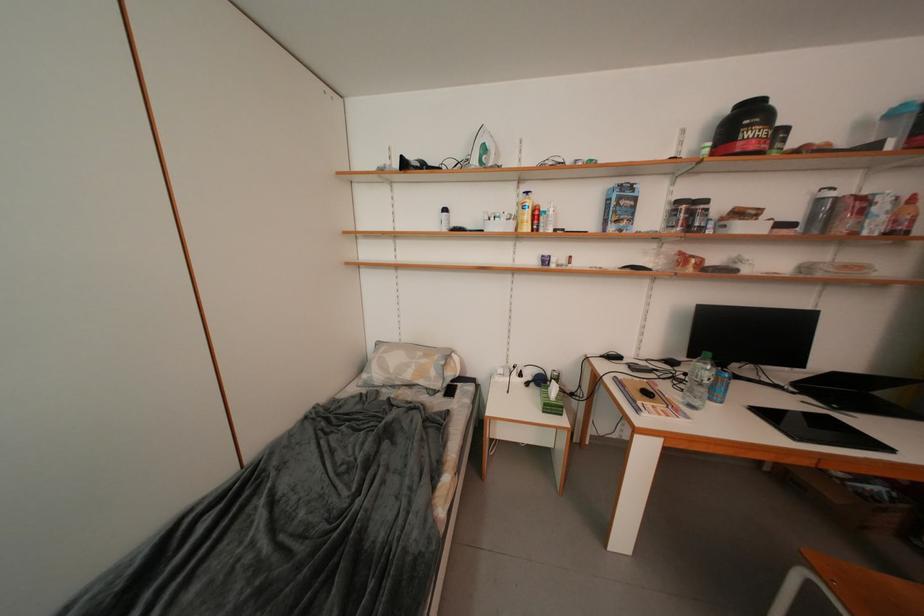
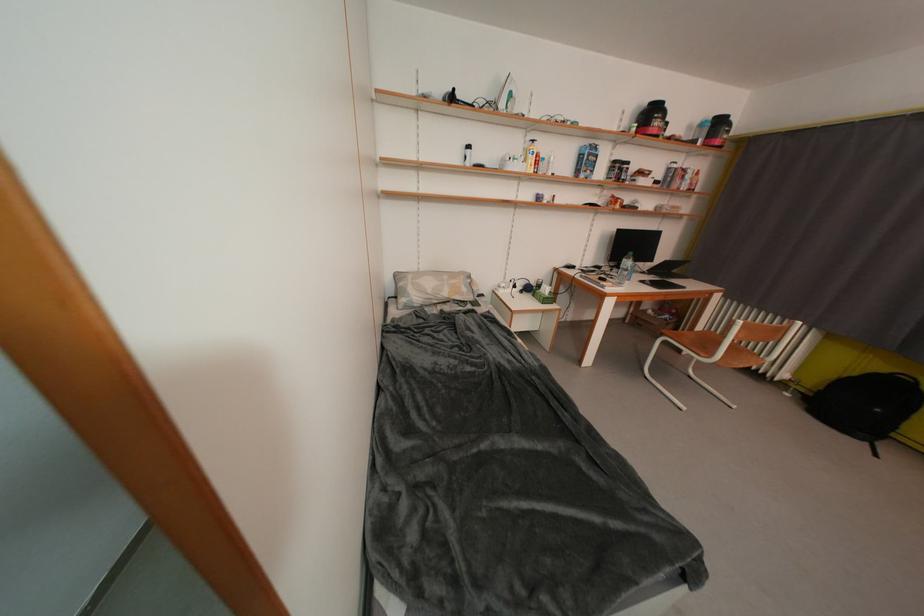
Locate, in the second image, the point that corresponds to [760,151] in the first image.

(663, 136)